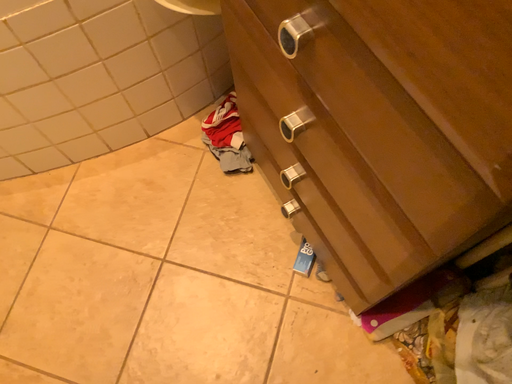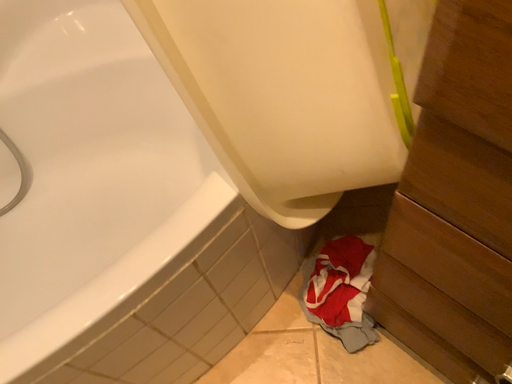
Question: How did the camera likely rotate when shooting the video?

Choices:
 (A) rotated upward
 (B) rotated downward

Answer: (A)